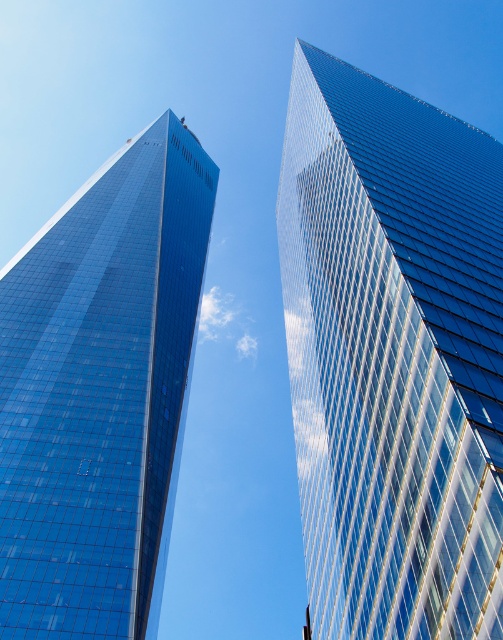
You are an architect evaluating the two skyscrapers in the image. Which of the two, the transparent glass skyscraper at upper center or the shiny glass skyscraper at left, is shorter?

The transparent glass skyscraper at upper center is shorter than the shiny glass skyscraper at left.

You are a drone operator tasked with flying a drone between the transparent glass skyscraper at upper center and the shiny glass skyscraper at left. The drone has a wingspan of 1.5 meters. Based on the scene, can the drone safely navigate the space between them?

The distance between the transparent glass skyscraper at upper center and the shiny glass skyscraper at left is 43.48 meters, which is more than sufficient for the drone with a 1.5 meter wingspan to safely navigate the space between them.